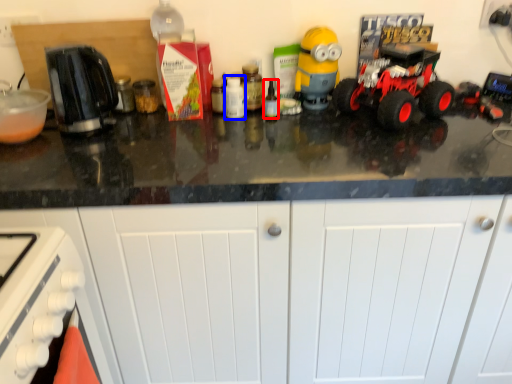
Question: Which point is further to the camera, bottle (highlighted by a red box) or bottle (highlighted by a blue box)?

Choices:
 (A) bottle
 (B) bottle

Answer: (B)